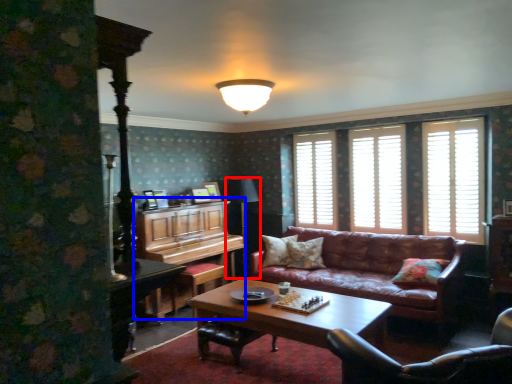
Question: Which point is further to the camera, table lamp (highlighted by a red box) or dresser (highlighted by a blue box)?

Choices:
 (A) table lamp
 (B) dresser

Answer: (A)